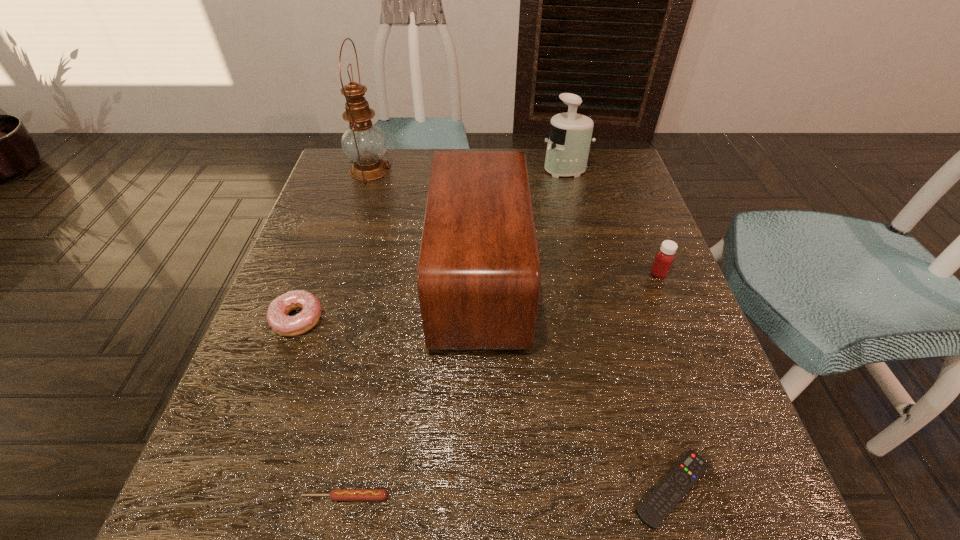
Find the location of `doughnut situated at the left edge`. doughnut situated at the left edge is located at coordinates (307, 318).

Identify the location of sausage located at the left edge. This screenshot has height=540, width=960. (336, 494).

Identify the location of juicer at the right edge. Image resolution: width=960 pixels, height=540 pixels. (570, 135).

Image resolution: width=960 pixels, height=540 pixels. In order to click on medicine present at the right edge in this screenshot , I will do `click(664, 258)`.

Locate an element on the screen. The width and height of the screenshot is (960, 540). remote control that is at the right edge is located at coordinates (666, 495).

Find the location of a particular element. This screenshot has height=540, width=960. object that is at the far left corner is located at coordinates (364, 143).

The height and width of the screenshot is (540, 960). Identify the location of object present at the near left corner. (336, 494).

Where is `object at the far right corner`? object at the far right corner is located at coordinates (570, 135).

At what (x,y) coordinates should I click in order to perform the action: click on object at the near right corner. Please return your answer as a coordinate pair (x, y). This screenshot has width=960, height=540. Looking at the image, I should click on (666, 495).

Where is `free space at the far edge of the desktop`? The width and height of the screenshot is (960, 540). free space at the far edge of the desktop is located at coordinates pos(562,193).